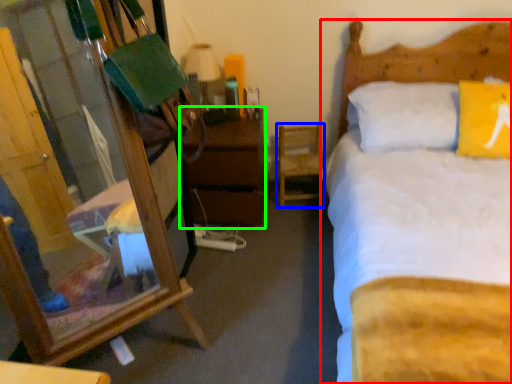
Question: Considering the real-world distances, which object is closest to bed (highlighted by a red box)? chair (highlighted by a blue box) or nightstand (highlighted by a green box).

Choices:
 (A) chair
 (B) nightstand

Answer: (A)